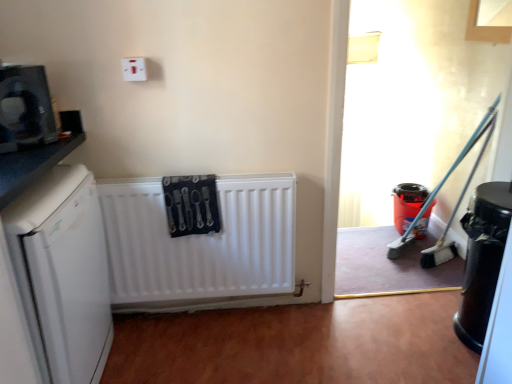
Identify the location of free location to the left of matte plastic bucket at right, the first appliance from the back. coord(371,236).